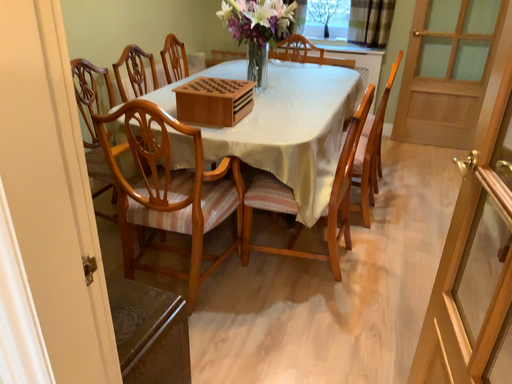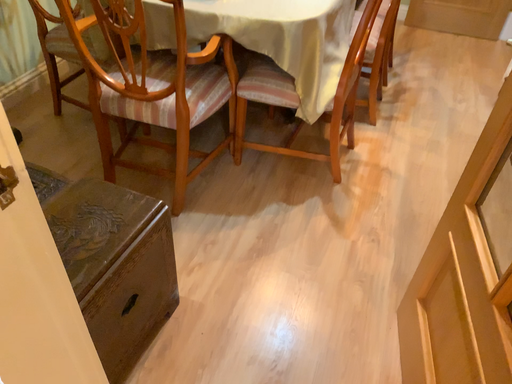
Question: Which way did the camera rotate in the video?

Choices:
 (A) rotated upward
 (B) rotated downward

Answer: (B)